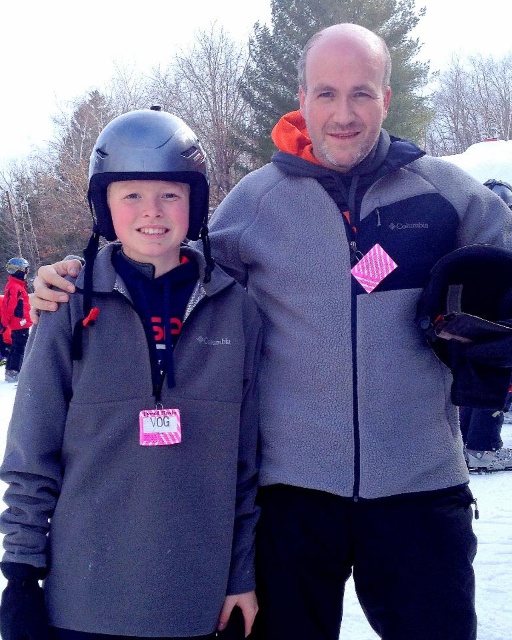
Question: Is matte gray jacket at center wider than matte black helmet at left?

Choices:
 (A) no
 (B) yes

Answer: (A)

Question: Which point is closer to the camera?

Choices:
 (A) matte gray jacket at center
 (B) metallic gray helmet at left
 (C) matte black helmet at left

Answer: (A)

Question: Which object is positioned farthest from the matte gray jacket at center?

Choices:
 (A) matte black helmet at left
 (B) metallic gray helmet at left

Answer: (A)

Question: Can you confirm if metallic gray helmet at left is thinner than matte black helmet at left?

Choices:
 (A) yes
 (B) no

Answer: (A)

Question: Which object is positioned farthest from the matte black helmet at left?

Choices:
 (A) metallic gray helmet at left
 (B) matte gray jacket at center

Answer: (B)

Question: Can you confirm if metallic gray helmet at left is positioned above matte black helmet at left?

Choices:
 (A) yes
 (B) no

Answer: (B)